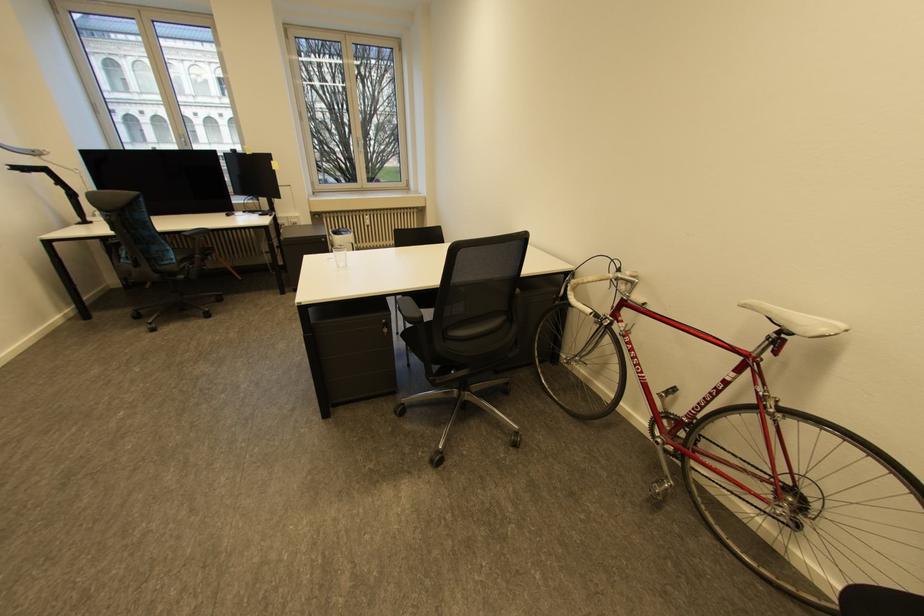
Where would you grasp the white bicycle handlebar? Please return your answer as a coordinate pair (x, y).

(578, 296)